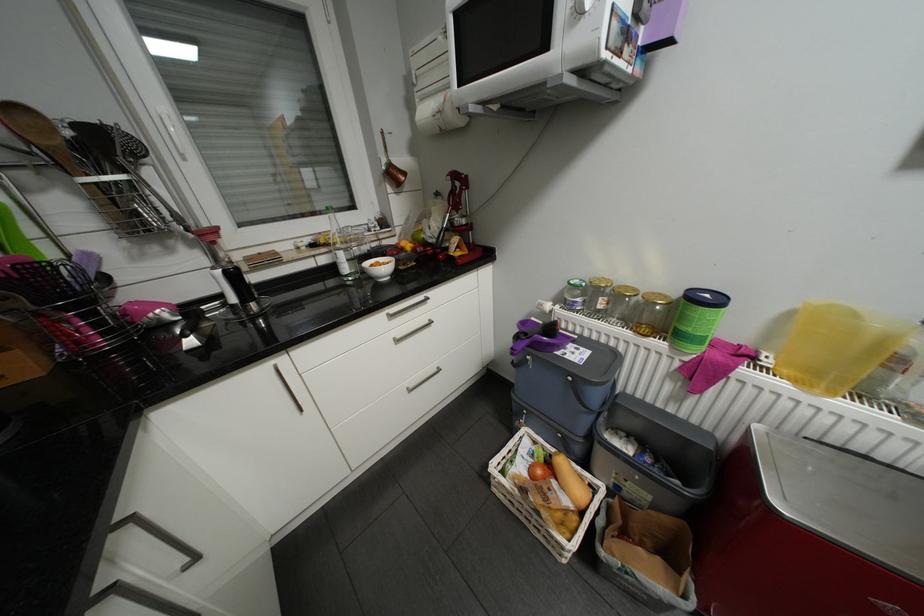
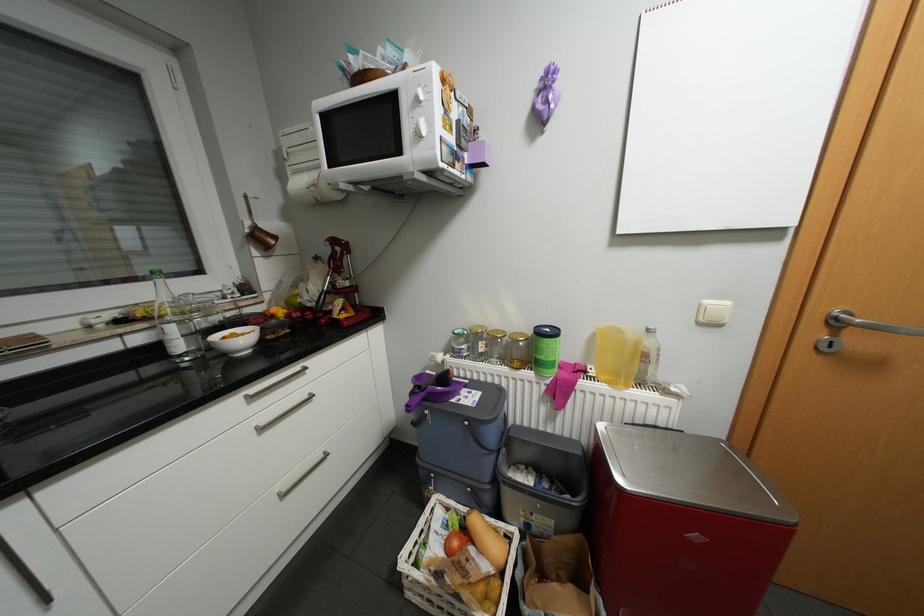
In the second image, find the point that corresponds to point 354,267 in the first image.

(188, 345)